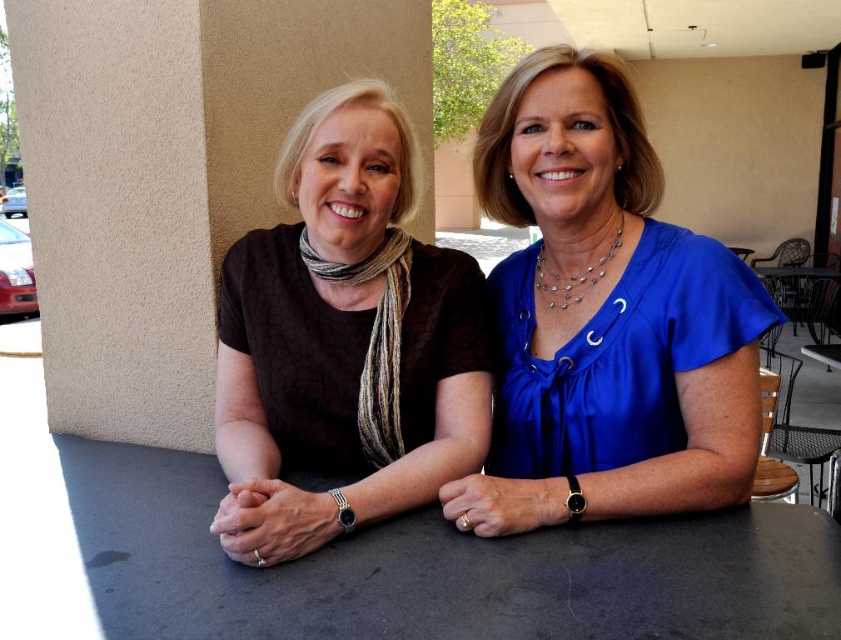
Question: Is blue silk blouse at center positioned behind matte brown blouse at center?

Choices:
 (A) yes
 (B) no

Answer: (A)

Question: Does blue silk blouse at center have a smaller size compared to matte brown blouse at center?

Choices:
 (A) yes
 (B) no

Answer: (B)

Question: Which point is closer to the camera?

Choices:
 (A) blue silk blouse at center
 (B) matte brown blouse at center

Answer: (B)

Question: Is blue silk blouse at center positioned at the back of matte brown blouse at center?

Choices:
 (A) yes
 (B) no

Answer: (A)